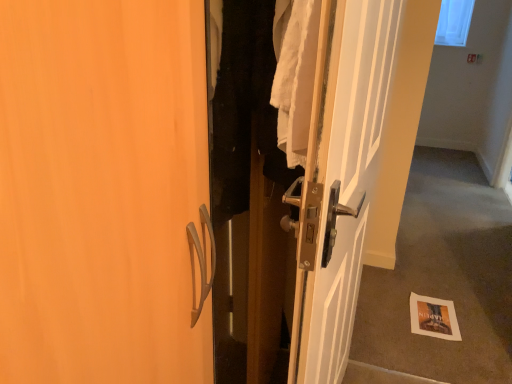
Question: From the image's perspective, is carpeted floor at lower right on top of transparent plastic window screen at upper right?

Choices:
 (A) no
 (B) yes

Answer: (A)

Question: Can we say carpeted floor at lower right lies outside transparent plastic window screen at upper right?

Choices:
 (A) yes
 (B) no

Answer: (A)

Question: Would you consider carpeted floor at lower right to be distant from transparent plastic window screen at upper right?

Choices:
 (A) yes
 (B) no

Answer: (A)

Question: Considering the relative sizes of carpeted floor at lower right and transparent plastic window screen at upper right in the image provided, is carpeted floor at lower right wider than transparent plastic window screen at upper right?

Choices:
 (A) yes
 (B) no

Answer: (B)

Question: From a real-world perspective, is carpeted floor at lower right on top of transparent plastic window screen at upper right?

Choices:
 (A) no
 (B) yes

Answer: (A)

Question: Is white glossy door at center wider or thinner than transparent plastic window screen at upper right?

Choices:
 (A) thin
 (B) wide

Answer: (A)

Question: Choose the correct answer: Is white glossy door at center inside transparent plastic window screen at upper right or outside it?

Choices:
 (A) outside
 (B) inside

Answer: (A)

Question: From a real-world perspective, is white glossy door at center positioned above or below transparent plastic window screen at upper right?

Choices:
 (A) below
 (B) above

Answer: (A)

Question: From their relative heights in the image, would you say white glossy door at center is taller or shorter than transparent plastic window screen at upper right?

Choices:
 (A) short
 (B) tall

Answer: (B)

Question: From a real-world perspective, is white glossy door at center physically located above or below carpeted floor at lower right?

Choices:
 (A) below
 (B) above

Answer: (B)

Question: In the image, is white glossy door at center on the left side or the right side of carpeted floor at lower right?

Choices:
 (A) left
 (B) right

Answer: (A)

Question: Looking at their shapes, would you say white glossy door at center is wider or thinner than carpeted floor at lower right?

Choices:
 (A) wide
 (B) thin

Answer: (A)

Question: From the image's perspective, is white glossy door at center positioned above or below carpeted floor at lower right?

Choices:
 (A) above
 (B) below

Answer: (B)

Question: From a real-world perspective, is carpeted floor at lower right physically located above or below white glossy door at center?

Choices:
 (A) above
 (B) below

Answer: (B)

Question: In terms of height, does carpeted floor at lower right look taller or shorter compared to white glossy door at center?

Choices:
 (A) tall
 (B) short

Answer: (A)